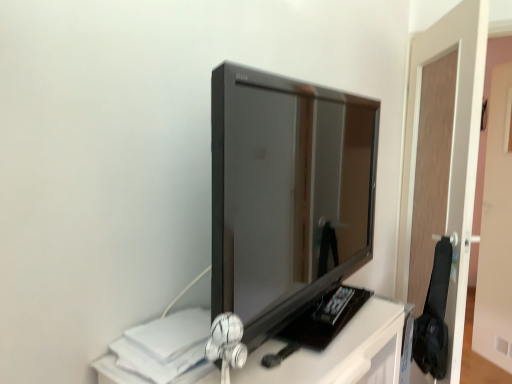
Question: In terms of width, does brown wooden door at right look wider or thinner when compared to glossy black tv at center?

Choices:
 (A) thin
 (B) wide

Answer: (A)

Question: Based on their sizes in the image, would you say brown wooden door at right is bigger or smaller than glossy black tv at center?

Choices:
 (A) big
 (B) small

Answer: (A)

Question: Does point (430, 210) appear closer or farther from the camera than point (347, 274)?

Choices:
 (A) closer
 (B) farther

Answer: (B)

Question: Which is correct: glossy black tv at center is inside brown wooden door at right, or outside of it?

Choices:
 (A) outside
 (B) inside

Answer: (A)

Question: From a real-world perspective, relative to brown wooden door at right, is glossy black tv at center vertically above or below?

Choices:
 (A) below
 (B) above

Answer: (B)

Question: Considering the positions of glossy black tv at center and brown wooden door at right in the image, is glossy black tv at center bigger or smaller than brown wooden door at right?

Choices:
 (A) big
 (B) small

Answer: (B)

Question: Based on their positions, is glossy black tv at center located to the left or right of brown wooden door at right?

Choices:
 (A) left
 (B) right

Answer: (A)